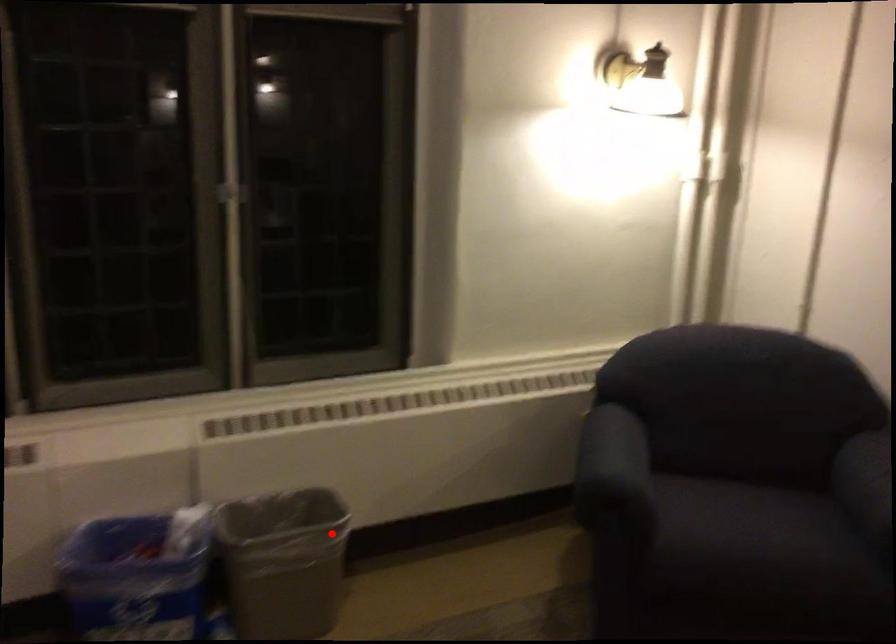
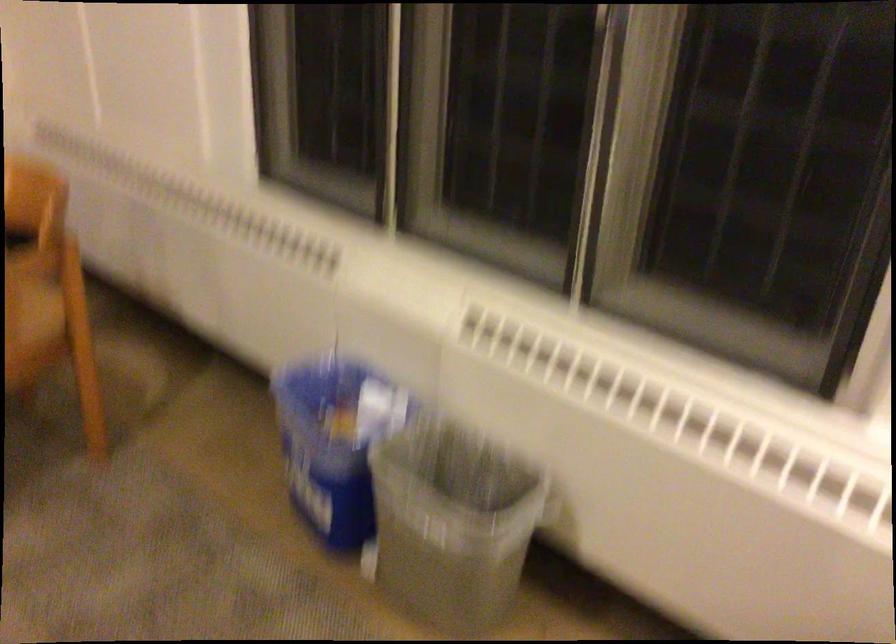
Question: A red point is marked in image1. In image2, is the corresponding 3D point closer to the camera or farther? Reply with the corresponding letter.

Choices:
 (A) The corresponding 3D point is closer.
 (B) The corresponding 3D point is farther.

Answer: (A)